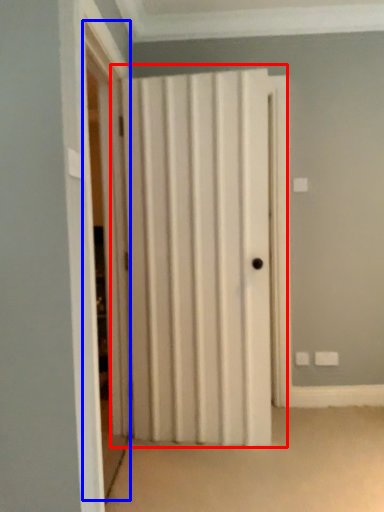
Question: Among these objects, which one is nearest to the camera, door (highlighted by a red box) or screen door (highlighted by a blue box)?

Choices:
 (A) door
 (B) screen door

Answer: (B)